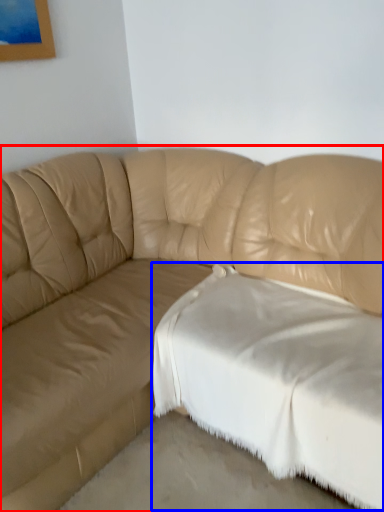
Question: Which point is closer to the camera, studio couch (highlighted by a red box) or sheet (highlighted by a blue box)?

Choices:
 (A) studio couch
 (B) sheet

Answer: (A)